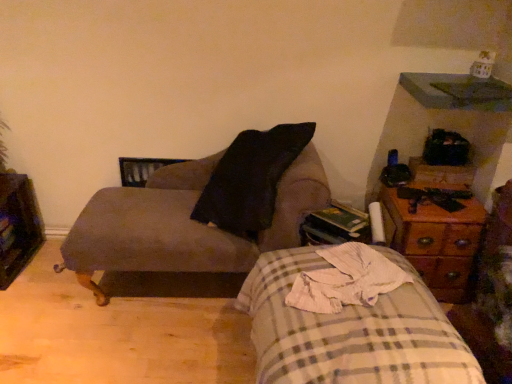
Question: From a real-world perspective, is wooden dresser at left above or below plaid fabric bed at lower right?

Choices:
 (A) below
 (B) above

Answer: (A)

Question: Based on their positions, is wooden dresser at left located to the left or right of plaid fabric bed at lower right?

Choices:
 (A) right
 (B) left

Answer: (B)

Question: Estimate the real-world distances between objects in this image. Which object is farther from the woodenmaterial/texturenightstand at right?

Choices:
 (A) wooden dresser at left
 (B) suede-like brown chair at upper left
 (C) plaid fabric bed at lower right

Answer: (A)

Question: Which is farther from the plaid fabric bed at lower right?

Choices:
 (A) woodenmaterial/texturenightstand at right
 (B) suede-like brown chair at upper left
 (C) wooden dresser at left

Answer: (C)